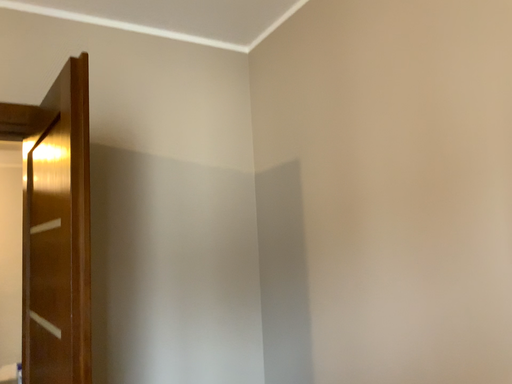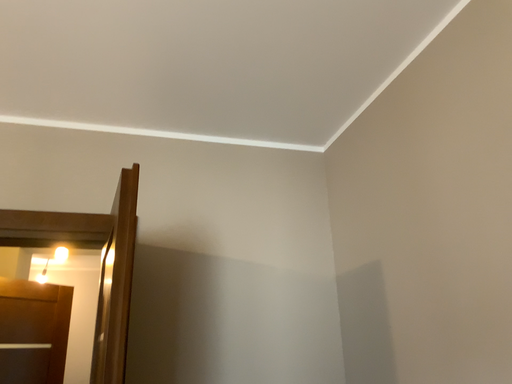
Question: How did the camera likely rotate when shooting the video?

Choices:
 (A) rotated downward
 (B) rotated upward

Answer: (B)